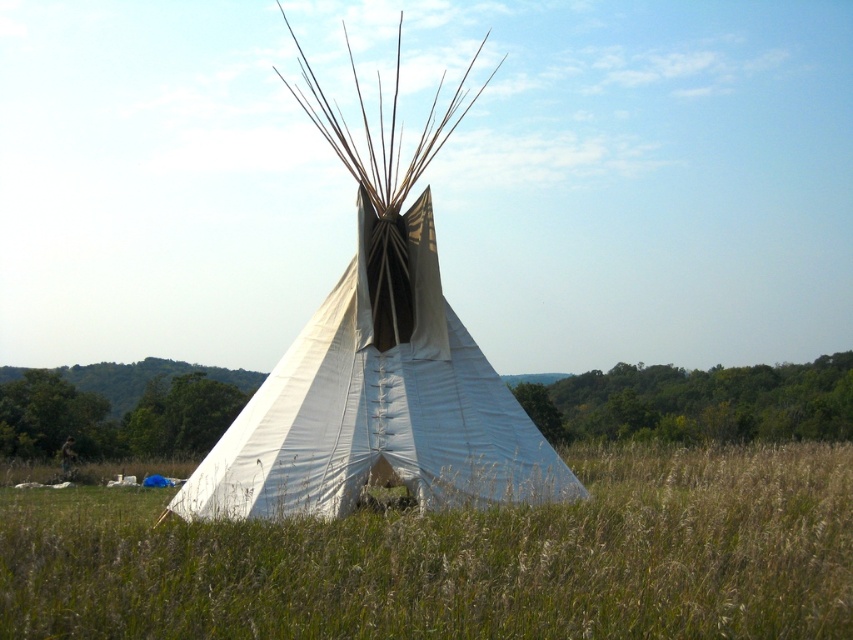
Question: Can you confirm if green grassy field at center is positioned below white canvas tent at center?

Choices:
 (A) yes
 (B) no

Answer: (A)

Question: Among these objects, which one is farthest from the camera?

Choices:
 (A) green grassy field at center
 (B) white canvas tent at center

Answer: (B)

Question: Observing the image, what is the correct spatial positioning of green grassy field at center in reference to white canvas tent at center?

Choices:
 (A) left
 (B) right

Answer: (B)

Question: Does green grassy field at center have a larger size compared to white canvas tent at center?

Choices:
 (A) no
 (B) yes

Answer: (B)

Question: Which point is closer to the camera?

Choices:
 (A) (289, 404)
 (B) (695, 600)

Answer: (B)

Question: Which object appears farthest from the camera in this image?

Choices:
 (A) white canvas tent at center
 (B) green grassy field at center

Answer: (A)